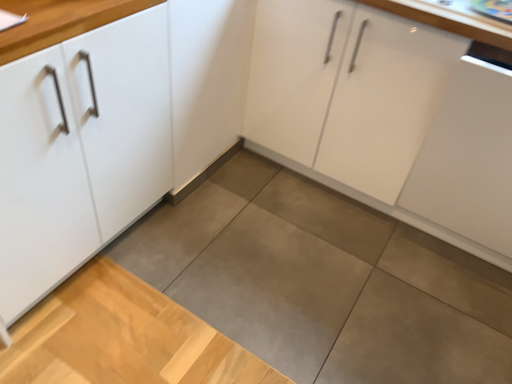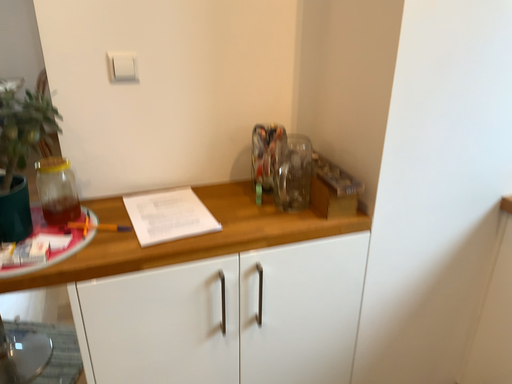
Question: Which way did the camera rotate in the video?

Choices:
 (A) rotated upward
 (B) rotated downward

Answer: (A)